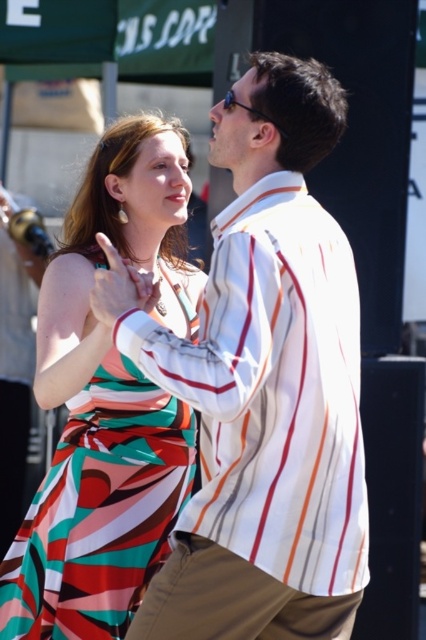
Is multicolored striped dress at center above khaki pants at lower center?

Indeed, multicolored striped dress at center is positioned over khaki pants at lower center.

What are the coordinates of `multicolored striped dress at center` in the screenshot? It's located at (106, 403).

At what (x,y) coordinates should I click in order to perform the action: click on multicolored striped dress at center. Please return your answer as a coordinate pair (x, y). This screenshot has height=640, width=426. Looking at the image, I should click on (106, 403).

Is white striped shirt at center bigger than multicolored striped dress at center?

No, white striped shirt at center is not bigger than multicolored striped dress at center.

Can you confirm if white striped shirt at center is wider than multicolored striped dress at center?

Yes.

At what (x,y) coordinates should I click in order to perform the action: click on white striped shirt at center. Please return your answer as a coordinate pair (x, y). The width and height of the screenshot is (426, 640). Looking at the image, I should click on (262, 384).

Which of these two, white striped shirt at center or khaki pants at lower center, stands shorter?

With less height is khaki pants at lower center.

Is white striped shirt at center to the left of khaki pants at lower center from the viewer's perspective?

Indeed, white striped shirt at center is positioned on the left side of khaki pants at lower center.

Which is behind, point (106, 278) or point (359, 593)?

The point (106, 278) is behind.

Image resolution: width=426 pixels, height=640 pixels. Find the location of `white striped shirt at center`. white striped shirt at center is located at coordinates (262, 384).